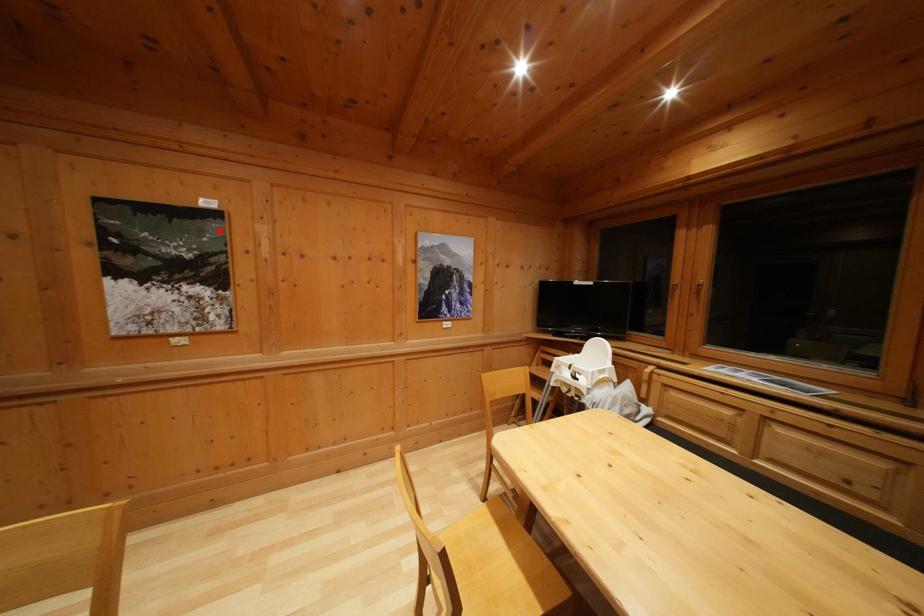
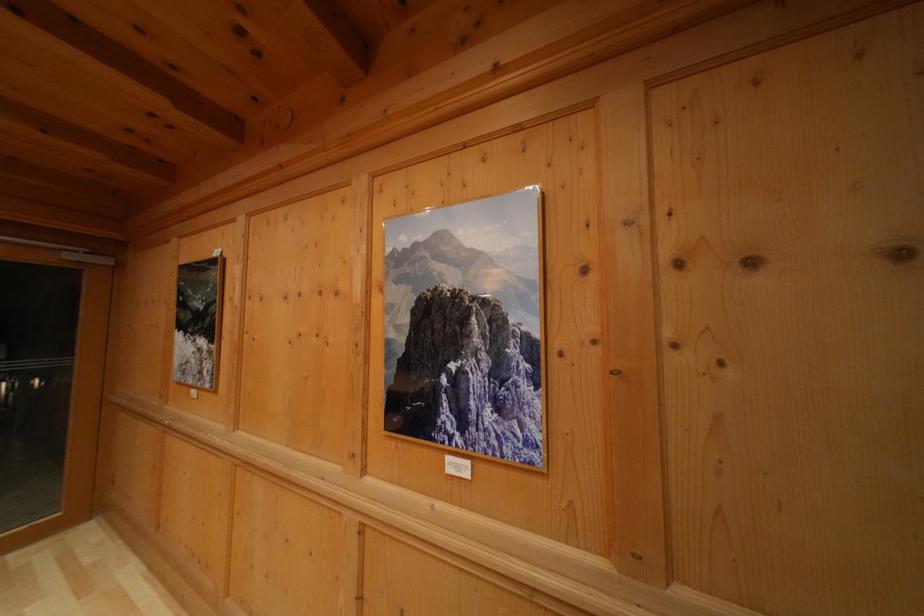
Locate, in the second image, the point that corresponds to the highlighted location in the first image.

(222, 281)